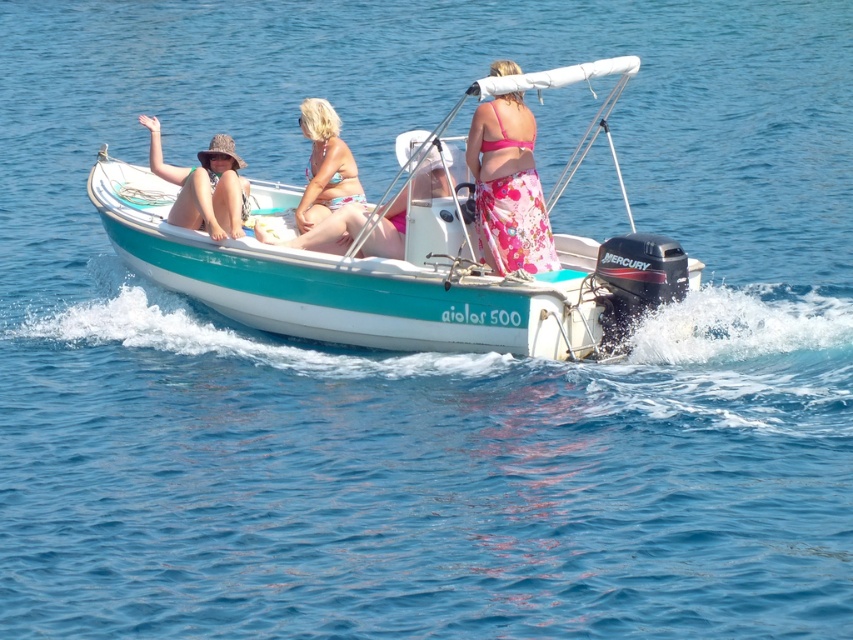
You are on the boat and want to place a life jacket. You have two points to choose from. One is at point (509, 182) and the other is at point (224, 227). Which point is closer to you where you are standing?

Point (509, 182) is closer to the viewer than point (224, 227), so you should place the life jacket at point (509, 182).

You are planning to place a small flag on the teal glossy boat at center and the matte straw hat at left. Which object requires a taller flagpole to accommodate its height?

The teal glossy boat at center requires a taller flagpole because it is much taller than the matte straw hat at left according to the description.